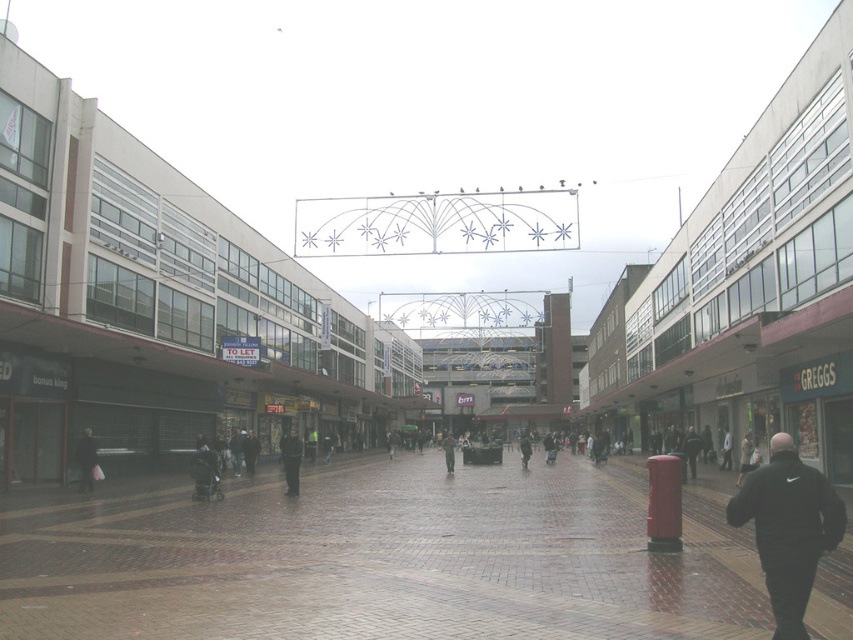
You are standing at the point with coordinates point (521, 438) and want to walk to the point with coordinates point (80, 467). Which direction should you move to reach your destination?

You should move forward because point (80, 467) is in front of point (521, 438).

Looking at this image, you are standing at point (450, 456) and want to walk to point (780, 554). Which direction should you move relative to the shopping center layout?

You should move forward towards point (780, 554) since it is in front of point (450, 456) in the shopping center layout.